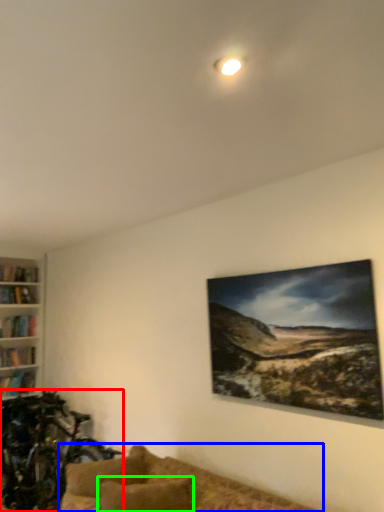
Question: Estimate the real-world distances between objects in this image. Which object is closer to mountain bike (highlighted by a red box), studio couch (highlighted by a blue box) or pillow (highlighted by a green box)?

Choices:
 (A) studio couch
 (B) pillow

Answer: (A)